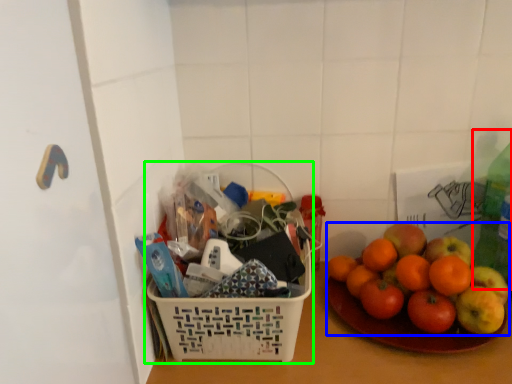
Question: Which object is the closest to the bottle (highlighted by a red box)? Choose among these: grapefruit (highlighted by a blue box) or basket (highlighted by a green box).

Choices:
 (A) grapefruit
 (B) basket

Answer: (A)